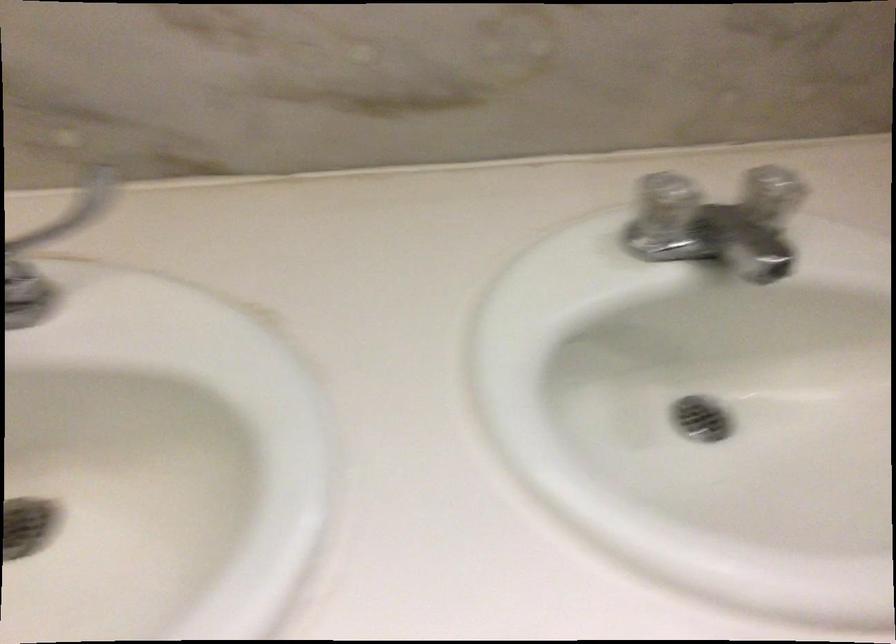
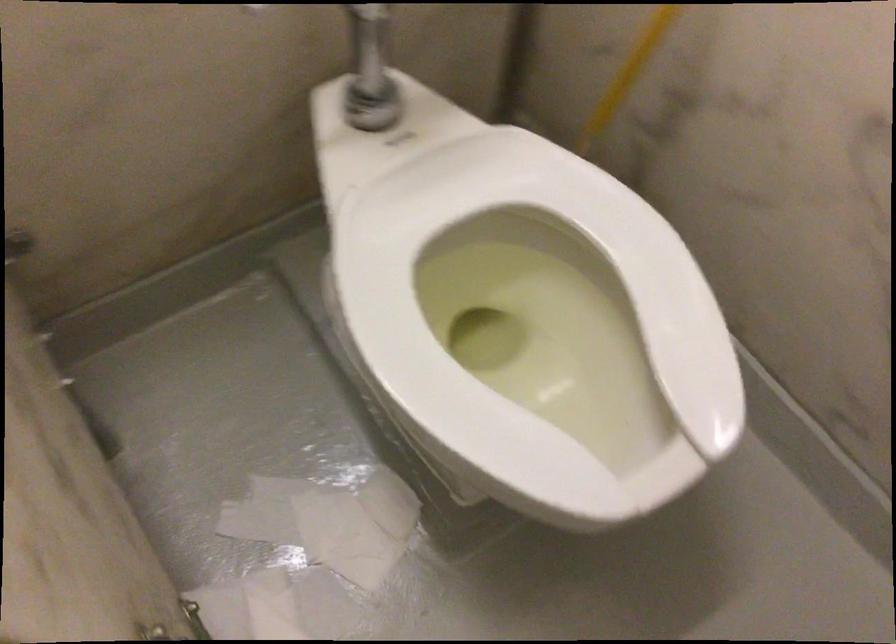
Question: Which direction would the cameraman need to move to produce the second image? Reply with the corresponding letter.

Choices:
 (A) Left
 (B) Right
 (C) Forward
 (D) Backward

Answer: (B)